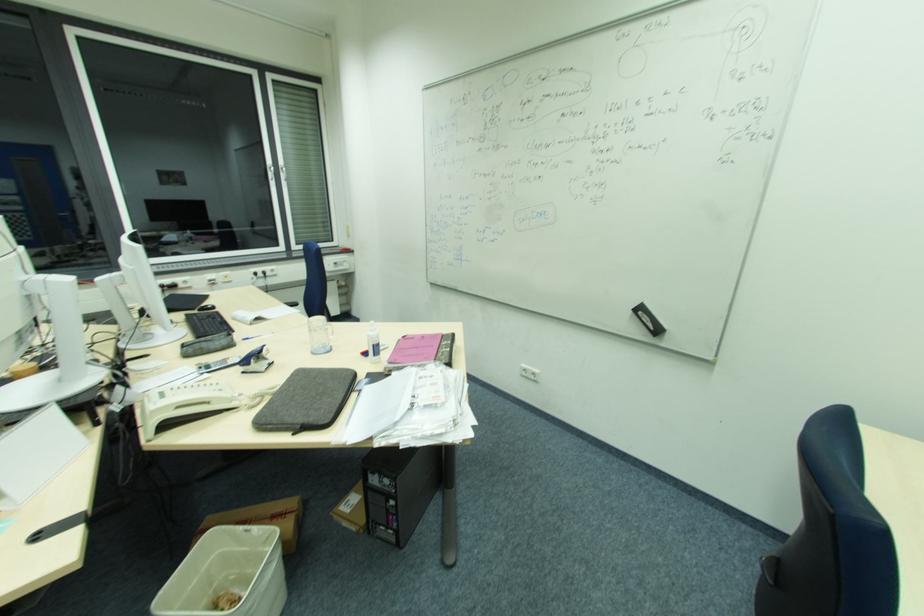
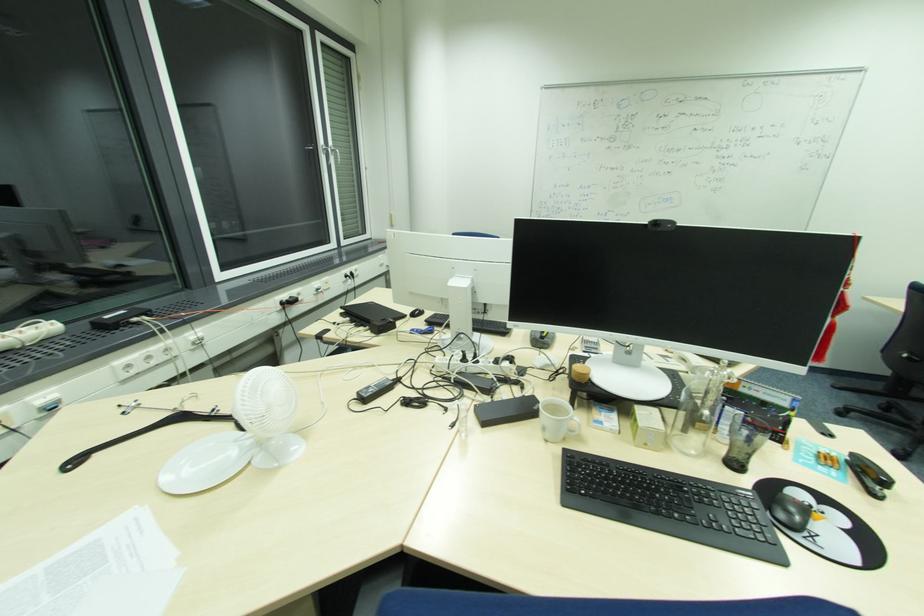
Locate, in the second image, the point that corresponds to the point at 403,338 in the first image.

(650, 300)